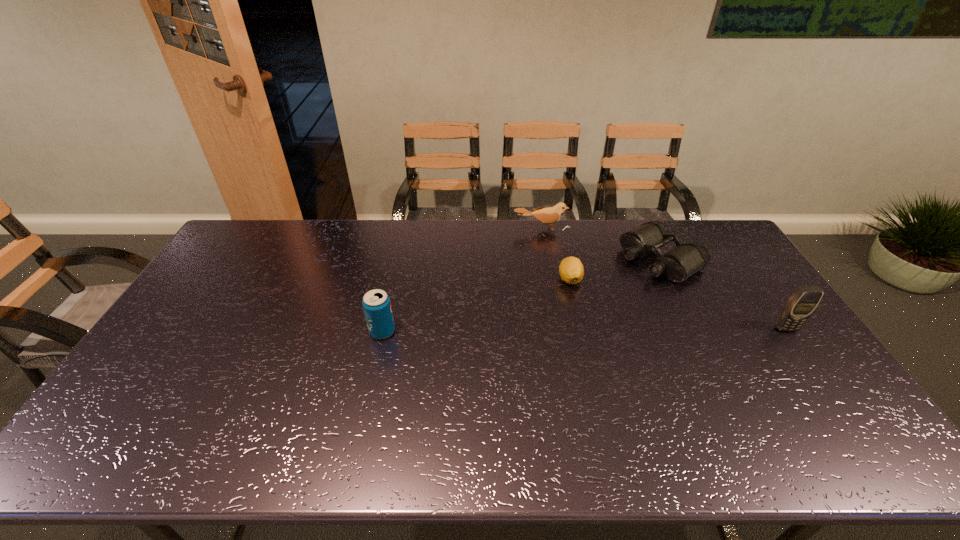
I want to click on free space on the desktop that is between the fourth shortest object and the rightmost object and is positioned at the stem end of the lemon, so click(551, 330).

Locate an element on the screen. This screenshot has width=960, height=540. free space on the desktop that is between the soda can and the rightmost object and is positioned through the eyepieces of the fourth tallest object is located at coordinates (536, 330).

The height and width of the screenshot is (540, 960). I want to click on free space on the desktop that is between the fourth shortest object and the rightmost object and is positioned at the beak of the third tallest object, so tap(560, 330).